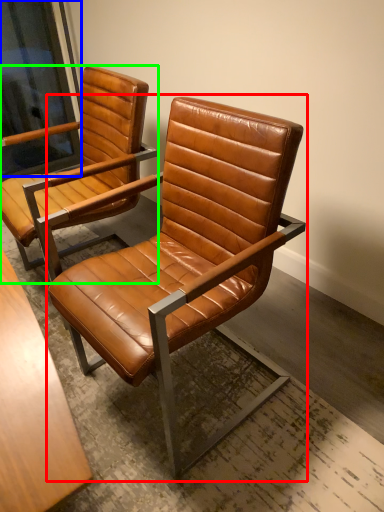
Question: Based on their relative distances, which object is farther from chair (highlighted by a red box)? Choose from window screen (highlighted by a blue box) and chair (highlighted by a green box).

Choices:
 (A) window screen
 (B) chair

Answer: (A)